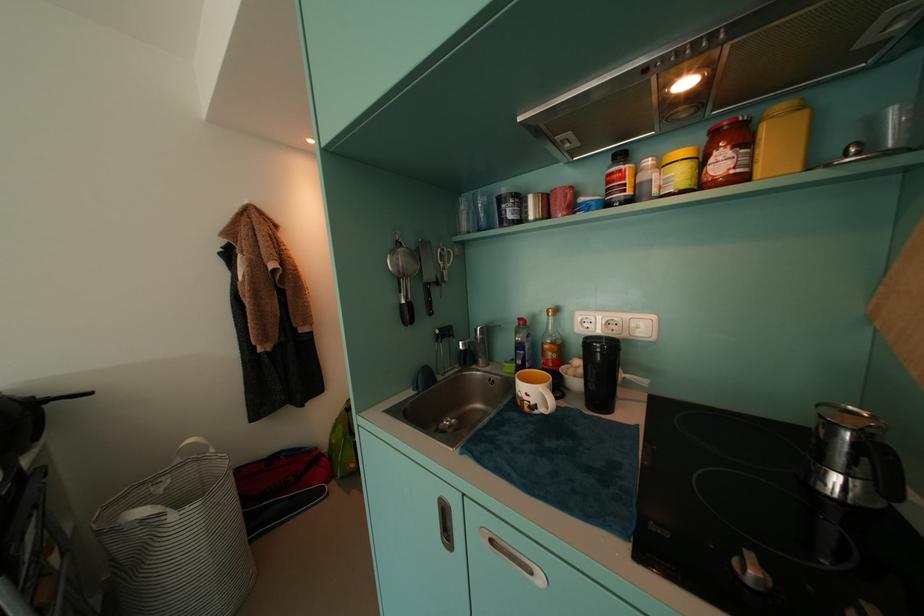
The image size is (924, 616). What do you see at coordinates (545, 400) in the screenshot?
I see `a red mug handle` at bounding box center [545, 400].